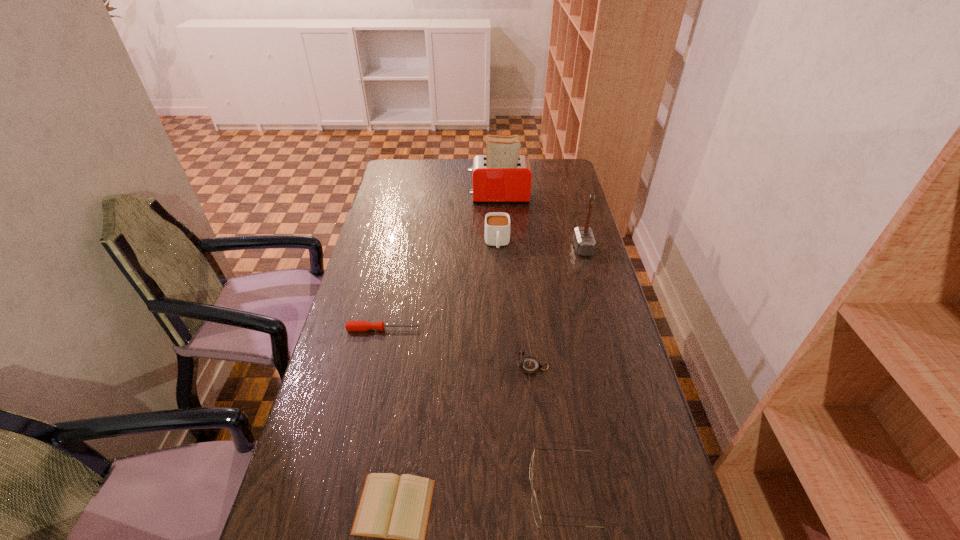
Locate an element on the screen. The image size is (960, 540). free space located 0.120m on the front-facing side of the fifth tallest object is located at coordinates (476, 491).

The height and width of the screenshot is (540, 960). I want to click on vacant area situated 0.180m on the front-facing side of the fifth tallest object, so click(449, 491).

You are a GUI agent. You are given a task and a screenshot of the screen. Output one action in this format:
    pyautogui.click(x=<x>, y=<y>)
    Task: Click on the vacant space located at the tip of the fourth nearest object
    This screenshot has height=540, width=960.
    Given the screenshot: What is the action you would take?
    pyautogui.click(x=537, y=329)

In order to click on object located in the left edge section of the desktop in this screenshot , I will do `click(350, 325)`.

Where is `object situated at the right edge`? object situated at the right edge is located at coordinates (583, 238).

The height and width of the screenshot is (540, 960). What are the coordinates of `vacant space at the far edge of the desktop` in the screenshot? It's located at (424, 174).

Identify the location of vacant space at the left edge of the desktop. The width and height of the screenshot is (960, 540). tap(334, 360).

Where is `free location at the right edge`? Image resolution: width=960 pixels, height=540 pixels. free location at the right edge is located at coordinates (569, 197).

You are a GUI agent. You are given a task and a screenshot of the screen. Output one action in this format:
    pyautogui.click(x=<x>, y=<y>)
    Task: Click on the free area in between the screwdriver and the fourth shortest object
    The width and height of the screenshot is (960, 540).
    Given the screenshot: What is the action you would take?
    pyautogui.click(x=458, y=348)

Where is `vacant area that lies between the cup and the fourth farthest object`? Image resolution: width=960 pixels, height=540 pixels. vacant area that lies between the cup and the fourth farthest object is located at coordinates click(x=441, y=286).